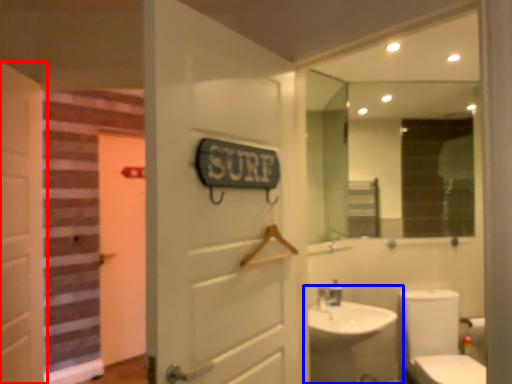
Question: Which point is closer to the camera, door (highlighted by a red box) or sink (highlighted by a blue box)?

Choices:
 (A) door
 (B) sink

Answer: (A)